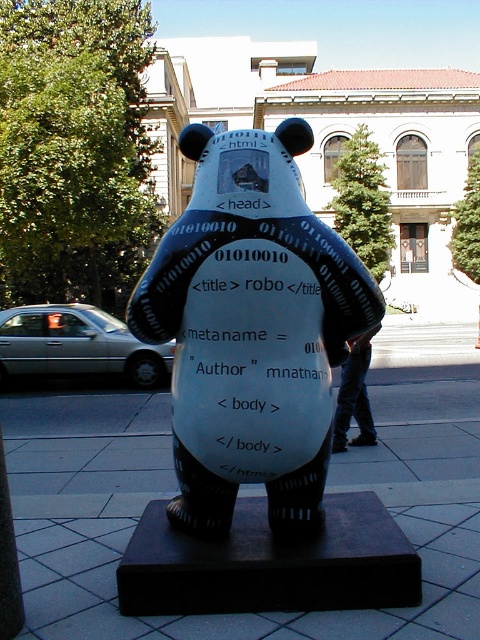
You are a photographer trying to capture the bear sculpture. You want to focus on the point at coordinates [252,330]. Based on the scene description, where exactly on the bear sculpture should you aim your camera?

The point at coordinates [252,330] is on the white glossy bear at center, so you should aim your camera at the center of the bear sculpture to capture that point.

You are standing in front of the bear sculpture and notice two points marked on its base. The first point is at coordinate location (289, 294) and the second point is at (36, 426). Which point is closer to your current position?

Point (289, 294) is closer to the camera than point (36, 426), so the first point is closer to your current position.

You are a park visitor standing at the entrance of the paved area. You want to find the white glossy bear at center. According to the coordinates provided, in which direction should you walk from your current position to reach the bear?

The white glossy bear at center is located at coordinates point [252,330]. Since you are at the entrance, you should walk towards the center of the paved area to reach the bear.